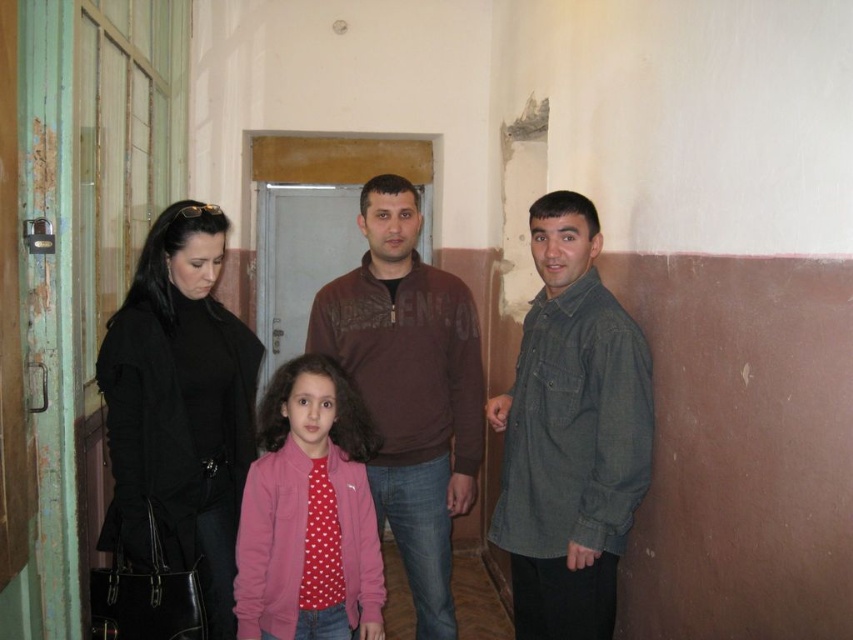
You are a tailor who needs to determine which garment requires more fabric. Based on the image, which one is larger between the black matte jacket at left and the dark green shirt at right?

The black matte jacket at left is larger in size than the dark green shirt at right, so it requires more fabric.

You are a photographer positioned in the hallway. You want to capture a clear photo of the black matte coat at left without any blur. The camera requires a subject to be at least 2 meters away to avoid motion blur. Can you take the photo as is?

The black matte coat at left is 1.93 meters away from camera, which is less than the required 2 meters. Therefore, you cannot take the photo without motion blur.

Looking at this image, you are standing in the hallway and want to hand a document to the person wearing the dark green shirt at right. Which direction should you move to reach them from the black matte coat at left?

The dark green shirt at right is to the right of the black matte coat at left, so you should move to the right to reach them.